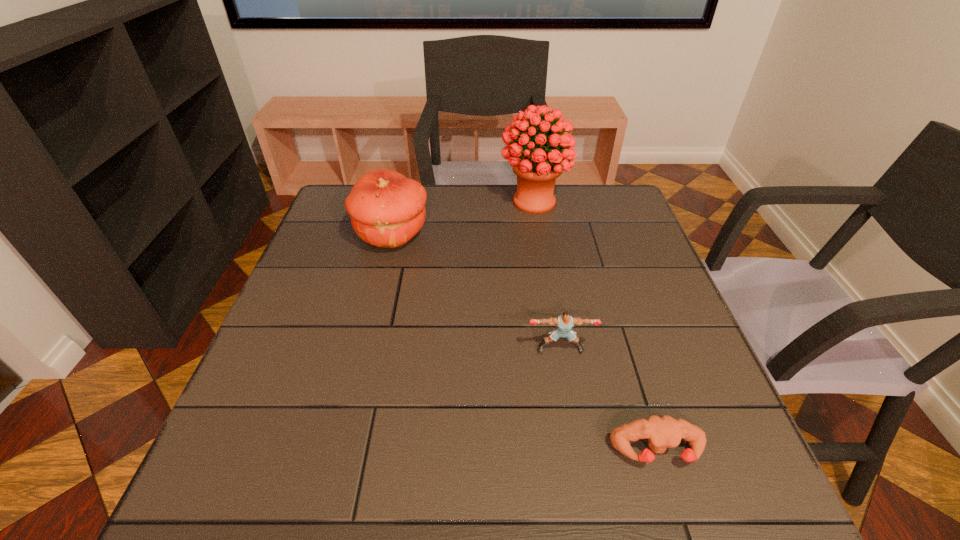
I want to click on the tallest object, so point(536,170).

I want to click on the third shortest object, so click(x=387, y=209).

Image resolution: width=960 pixels, height=540 pixels. I want to click on pumpkin, so click(x=387, y=209).

You are a GUI agent. You are given a task and a screenshot of the screen. Output one action in this format:
    pyautogui.click(x=<x>, y=<y>)
    Task: Click on the second shortest object
    The image size is (960, 540).
    Given the screenshot: What is the action you would take?
    pyautogui.click(x=565, y=322)

At what (x,y) coordinates should I click in order to perform the action: click on the farther puncher. Please return your answer as a coordinate pair (x, y). The image size is (960, 540). Looking at the image, I should click on (565, 322).

Where is `the shortest object`? Image resolution: width=960 pixels, height=540 pixels. the shortest object is located at coordinates (661, 432).

Where is `the shorter puncher`? The height and width of the screenshot is (540, 960). the shorter puncher is located at coordinates (661, 432).

Where is `blank area located 0.200m on the front of the bouquet`? The height and width of the screenshot is (540, 960). blank area located 0.200m on the front of the bouquet is located at coordinates (544, 264).

Locate an element on the screen. free space located on the left of the third shortest object is located at coordinates (337, 235).

Find the location of a particular element. The height and width of the screenshot is (540, 960). vacant region located 0.200m on the front-facing side of the farther puncher is located at coordinates (577, 444).